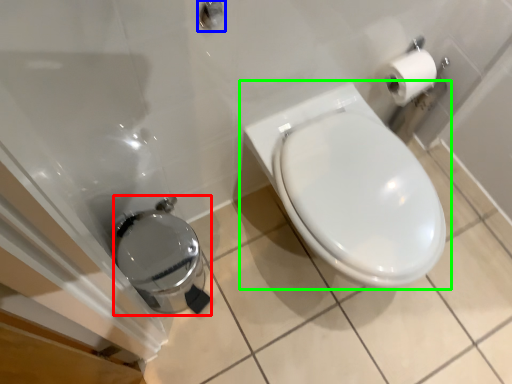
Question: Which object is positioned closest to porcelain (highlighted by a red box)? Select from shower (highlighted by a blue box) and toilet (highlighted by a green box).

Choices:
 (A) shower
 (B) toilet

Answer: (B)